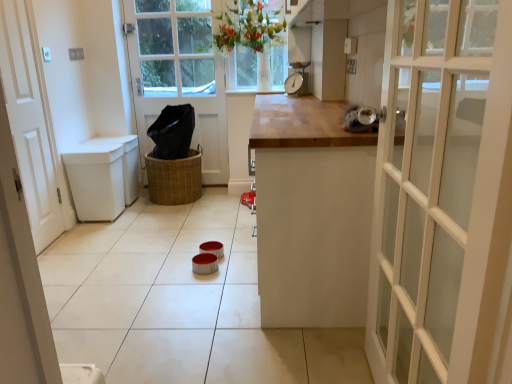
Where is `metallic scale at center`? Image resolution: width=512 pixels, height=384 pixels. metallic scale at center is located at coordinates (297, 79).

This screenshot has width=512, height=384. What do you see at coordinates (179, 75) in the screenshot?
I see `white wooden door at center, which ranks as the 1th door in back-to-front order` at bounding box center [179, 75].

The height and width of the screenshot is (384, 512). I want to click on braided wicker basket at center, so click(x=175, y=178).

Is braided wicker basket at center wider or thinner than metallic scale at center?

Considering their sizes, braided wicker basket at center looks broader than metallic scale at center.

Based on the photo, what's the angular difference between braided wicker basket at center and metallic scale at center's facing directions?

35.3 degrees.

From the picture: Which of these two, braided wicker basket at center or metallic scale at center, stands shorter?

metallic scale at center.

Which is in front, point (173, 172) or point (300, 91)?

The point (300, 91) is more forward.

Which point is more forward, (x=206, y=172) or (x=47, y=321)?

The point (x=47, y=321) is closer.

Where is `door that appears above the white matte door at left, which appears as the first door when viewed from the front (from the image's perspective)`? The width and height of the screenshot is (512, 384). door that appears above the white matte door at left, which appears as the first door when viewed from the front (from the image's perspective) is located at coordinates (179, 75).

Looking at this image, from a real-world perspective, is white wooden door at center, arranged as the second door when viewed from the left, on top of white matte door at left, which appears as the first door when viewed from the front?

Correct, in the physical world, white wooden door at center, arranged as the second door when viewed from the left, is higher than white matte door at left, which appears as the first door when viewed from the front.

Based on the photo, is white wooden door at center, the 1th door from the right, taller or shorter than white matte door at left, the 2th door in the back-to-front sequence?

In the image, white wooden door at center, the 1th door from the right, appears to be taller than white matte door at left, the 2th door in the back-to-front sequence.

From a real-world perspective, which is physically below, metallic scale at center or braided wicker basket at center?

In real-world perspective, braided wicker basket at center is lower.

Would you say braided wicker basket at center is part of metallic scale at center's contents?

No, braided wicker basket at center is not inside metallic scale at center.

From the image's perspective, relative to braided wicker basket at center, is metallic scale at center above or below?

From the image's perspective, metallic scale at center appears above braided wicker basket at center.

Measure the distance between metallic scale at center and braided wicker basket at center.

metallic scale at center and braided wicker basket at center are 1.18 meters apart.

Where is `basket below the white matte door at left, which appears as the first door when viewed from the front (from the image's perspective)`? Image resolution: width=512 pixels, height=384 pixels. basket below the white matte door at left, which appears as the first door when viewed from the front (from the image's perspective) is located at coordinates (175, 178).

From the picture: From the image's perspective, is white matte door at left, which appears as the first door when viewed from the front, located above or below braided wicker basket at center?

white matte door at left, which appears as the first door when viewed from the front, is above braided wicker basket at center.

Is white matte door at left, the second door from the right, next to braided wicker basket at center?

They are not placed beside each other.

Considering the sizes of objects white matte door at left, arranged as the first door when viewed from the left, and braided wicker basket at center in the image provided, who is wider, white matte door at left, arranged as the first door when viewed from the left, or braided wicker basket at center?

braided wicker basket at center is wider.

Is metallic scale at center in front of or behind white wooden door at center, which ranks as the 1th door in back-to-front order, in the image?

Clearly, metallic scale at center is in front of white wooden door at center, which ranks as the 1th door in back-to-front order.

Would you say metallic scale at center is to the left or to the right of white wooden door at center, arranged as the second door when viewed from the left, in the picture?

Based on their positions, metallic scale at center is located to the right of white wooden door at center, arranged as the second door when viewed from the left.

Is metallic scale at center in contact with white wooden door at center, which ranks as the 1th door in back-to-front order?

There is a gap between metallic scale at center and white wooden door at center, which ranks as the 1th door in back-to-front order.

From a real-world perspective, is metallic scale at center above or below white wooden door at center, the 2th door positioned from the front?

metallic scale at center is above white wooden door at center, the 2th door positioned from the front.

From the image's perspective, is braided wicker basket at center located above white matte door at left, the second door from the right?

No, from the image's perspective, braided wicker basket at center is not over white matte door at left, the second door from the right.

Is braided wicker basket at center turned away from white matte door at left, arranged as the first door when viewed from the left?

No, braided wicker basket at center is not facing away from white matte door at left, arranged as the first door when viewed from the left.

Find the location of a particular element. basket that appears below the white matte door at left, which appears as the first door when viewed from the front (from a real-world perspective) is located at coordinates (175, 178).

From a real-world perspective, is braided wicker basket at center physically below white matte door at left, which appears as the first door when viewed from the front?

Yes, from a real-world perspective, braided wicker basket at center is below white matte door at left, which appears as the first door when viewed from the front.

Is metallic scale at center further to the viewer compared to white matte door at left, the second door from the right?

Yes, it is.

Can you confirm if metallic scale at center is bigger than white matte door at left, the second door from the right?

No.

Image resolution: width=512 pixels, height=384 pixels. What are the coordinates of `appliance above the white matte door at left, the 2th door in the back-to-front sequence (from the image's perspective)` in the screenshot? It's located at (x=297, y=79).

Is metallic scale at center placed right next to white matte door at left, the second door from the right?

metallic scale at center and white matte door at left, the second door from the right, are not in contact.

You are a GUI agent. You are given a task and a screenshot of the screen. Output one action in this format:
    pyautogui.click(x=<x>, y=<y>)
    Task: Click on the appliance on the right of the braided wicker basket at center
    This screenshot has height=384, width=512.
    Given the screenshot: What is the action you would take?
    pyautogui.click(x=297, y=79)

Image resolution: width=512 pixels, height=384 pixels. Find the location of `door that is behind the white matte door at left, arranged as the first door when viewed from the left`. door that is behind the white matte door at left, arranged as the first door when viewed from the left is located at coordinates (179, 75).

Which object lies nearer to the anchor point metallic scale at center, white wooden door at center, the 2th door positioned from the front, or white matte door at left, the 2th door in the back-to-front sequence?

Among the two, white wooden door at center, the 2th door positioned from the front, is located nearer to metallic scale at center.

Estimate the real-world distances between objects in this image. Which object is further from white wooden door at center, arranged as the second door when viewed from the left, metallic scale at center or braided wicker basket at center?

Among the two, metallic scale at center is located further to white wooden door at center, arranged as the second door when viewed from the left.

Considering their positions, is white matte door at left, the second door from the right, positioned closer to metallic scale at center than white wooden door at center, which ranks as the 1th door in back-to-front order?

Based on the image, white wooden door at center, which ranks as the 1th door in back-to-front order, appears to be nearer to metallic scale at center.

Looking at the image, which one is located further to white wooden door at center, the 1th door from the right, braided wicker basket at center or metallic scale at center?

Among the two, metallic scale at center is located further to white wooden door at center, the 1th door from the right.

Looking at the image, which one is located further to white wooden door at center, the 1th door from the right, white matte door at left, which appears as the first door when viewed from the front, or metallic scale at center?

white matte door at left, which appears as the first door when viewed from the front, is further to white wooden door at center, the 1th door from the right.

Estimate the real-world distances between objects in this image. Which object is further from braided wicker basket at center, white matte door at left, the 2th door in the back-to-front sequence, or white wooden door at center, the 1th door from the right?

Among the two, white matte door at left, the 2th door in the back-to-front sequence, is located further to braided wicker basket at center.

Looking at the image, which one is located further to white matte door at left, the second door from the right, braided wicker basket at center or white wooden door at center, the 1th door from the right?

white wooden door at center, the 1th door from the right, lies further to white matte door at left, the second door from the right, than the other object.

Estimate the real-world distances between objects in this image. Which object is closer to white matte door at left, the 2th door in the back-to-front sequence, metallic scale at center or braided wicker basket at center?

braided wicker basket at center is closer to white matte door at left, the 2th door in the back-to-front sequence.

The height and width of the screenshot is (384, 512). I want to click on door between white matte door at left, arranged as the first door when viewed from the left, and metallic scale at center from left to right, so click(179, 75).

Where is `door located between braided wicker basket at center and metallic scale at center in the left-right direction`? The height and width of the screenshot is (384, 512). door located between braided wicker basket at center and metallic scale at center in the left-right direction is located at coordinates (179, 75).

This screenshot has height=384, width=512. Identify the location of basket between white matte door at left, arranged as the first door when viewed from the left, and metallic scale at center, in the horizontal direction. (175, 178).

This screenshot has width=512, height=384. What are the coordinates of `basket between white matte door at left, arranged as the first door when viewed from the left, and white wooden door at center, the 1th door from the right, in the front-back direction` in the screenshot? It's located at (175, 178).